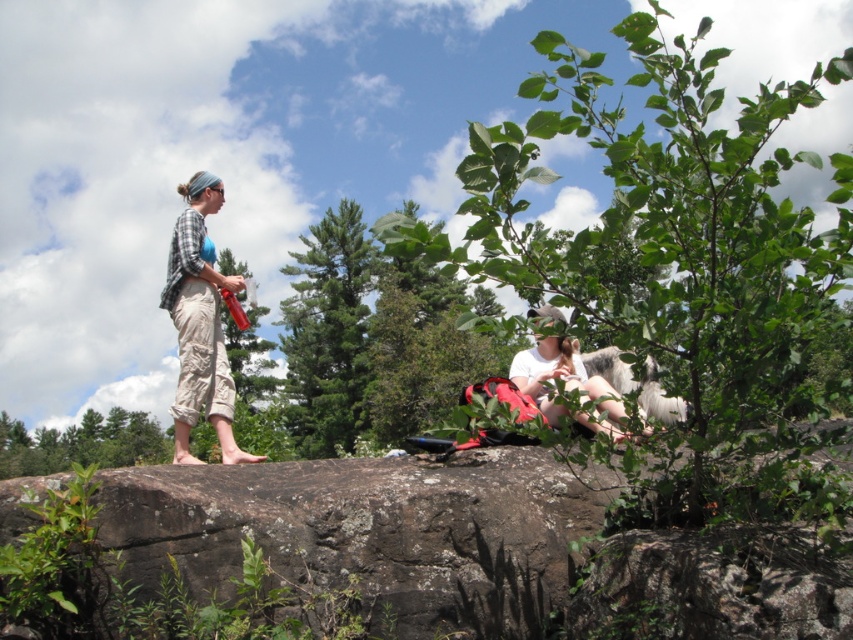
Does brown rough rock at center have a lesser height compared to plaid shirt at left?

Indeed, brown rough rock at center has a lesser height compared to plaid shirt at left.

Between point (439, 584) and point (180, 336), which one is positioned in front?

Point (439, 584) is more forward.

Does point (763, 580) come closer to viewer compared to point (230, 417)?

Yes, point (763, 580) is closer to viewer.

You are a GUI agent. You are given a task and a screenshot of the screen. Output one action in this format:
    pyautogui.click(x=<x>, y=<y>)
    Task: Click on the brown rough rock at center
    This screenshot has width=853, height=640.
    Given the screenshot: What is the action you would take?
    pyautogui.click(x=373, y=531)

Does plaid shirt at left have a lesser height compared to white cotton shirt at center?

No.

Does plaid shirt at left have a greater height compared to white cotton shirt at center?

Result: Yes, plaid shirt at left is taller than white cotton shirt at center.

Find the location of `plaid shirt at left`. plaid shirt at left is located at coordinates click(x=200, y=324).

Between point (523, 584) and point (612, 433), which one is positioned in front?

Point (523, 584)

Locate an element on the screen. brown rough rock at center is located at coordinates (x=373, y=531).